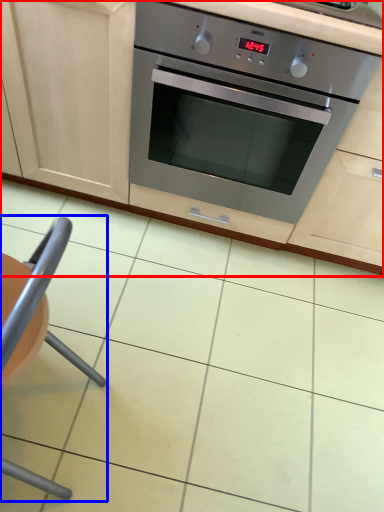
Question: Which of the following is the farthest to the observer, cabinetry (highlighted by a red box) or armchair (highlighted by a blue box)?

Choices:
 (A) cabinetry
 (B) armchair

Answer: (A)